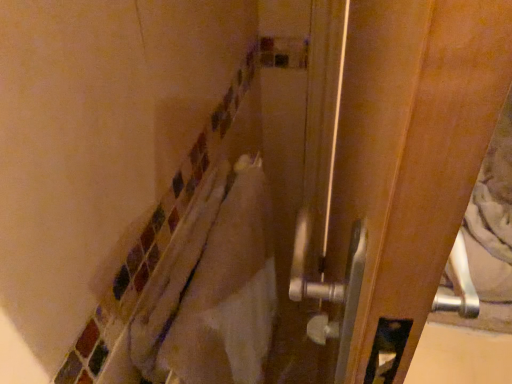
Question: Considering the relative positions of white towel at center and wooden screen door at right in the image provided, is white towel at center to the left of wooden screen door at right from the viewer's perspective?

Choices:
 (A) no
 (B) yes

Answer: (B)

Question: Considering the relative sizes of white towel at center and wooden screen door at right in the image provided, is white towel at center shorter than wooden screen door at right?

Choices:
 (A) yes
 (B) no

Answer: (A)

Question: Is wooden screen door at right inside white towel at center?

Choices:
 (A) no
 (B) yes

Answer: (A)

Question: Is white towel at center closer to the viewer compared to wooden screen door at right?

Choices:
 (A) no
 (B) yes

Answer: (A)

Question: From a real-world perspective, is white towel at center over wooden screen door at right?

Choices:
 (A) yes
 (B) no

Answer: (B)

Question: Considering the relative sizes of white towel at center and wooden screen door at right in the image provided, is white towel at center thinner than wooden screen door at right?

Choices:
 (A) no
 (B) yes

Answer: (A)

Question: Is wooden screen door at right thinner than white towel at center?

Choices:
 (A) no
 (B) yes

Answer: (B)

Question: Does wooden screen door at right have a greater width compared to white towel at center?

Choices:
 (A) yes
 (B) no

Answer: (B)

Question: Considering the relative sizes of wooden screen door at right and white towel at center in the image provided, is wooden screen door at right smaller than white towel at center?

Choices:
 (A) yes
 (B) no

Answer: (B)

Question: Is wooden screen door at right located outside white towel at center?

Choices:
 (A) no
 (B) yes

Answer: (B)

Question: Considering the relative sizes of wooden screen door at right and white towel at center in the image provided, is wooden screen door at right bigger than white towel at center?

Choices:
 (A) yes
 (B) no

Answer: (A)

Question: Can white towel at center be found inside wooden screen door at right?

Choices:
 (A) no
 (B) yes

Answer: (A)

Question: In terms of width, does wooden screen door at right look wider or thinner when compared to white towel at center?

Choices:
 (A) thin
 (B) wide

Answer: (A)